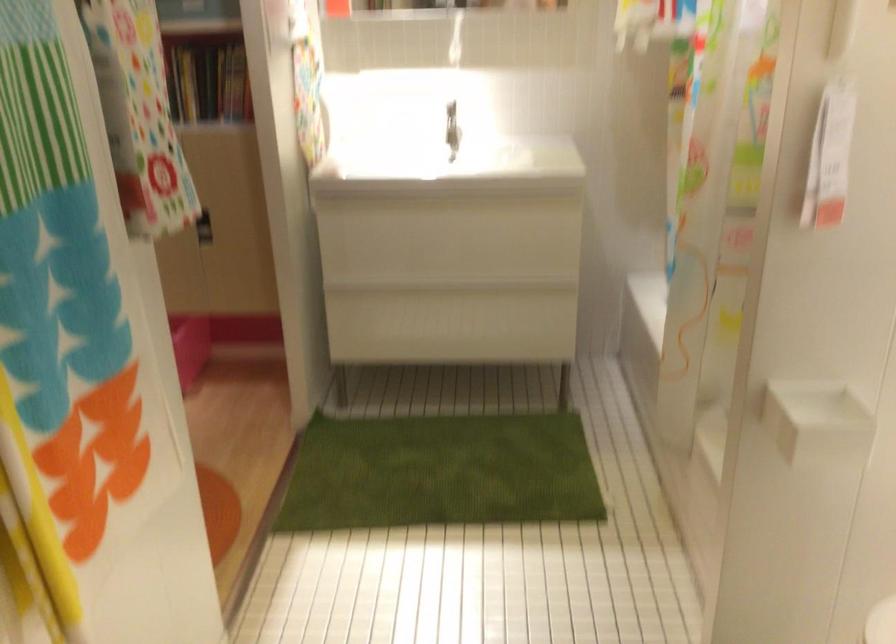
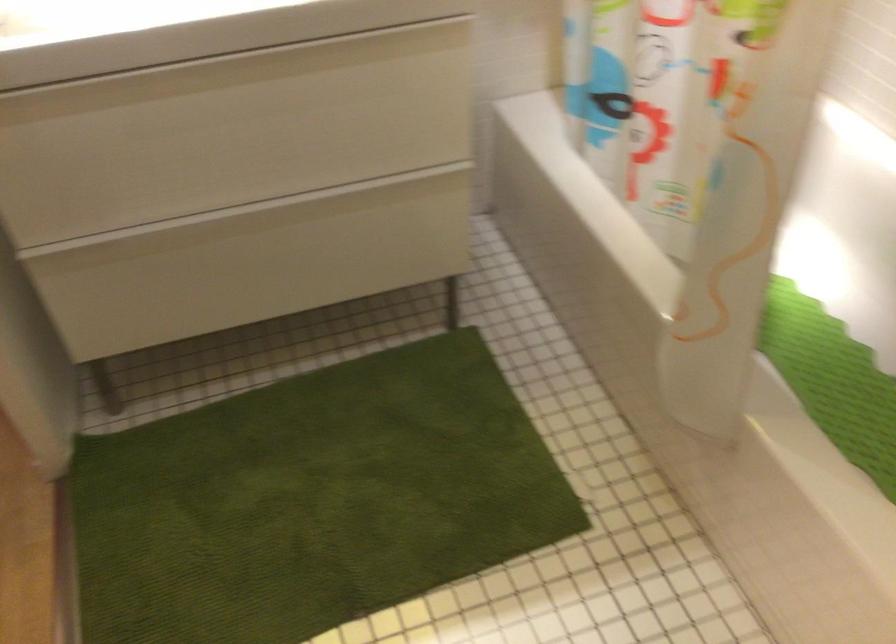
Where in the second image is the point corresponding to [450,202] from the first image?

(228, 70)